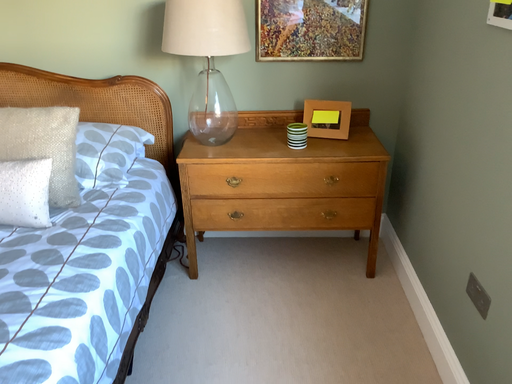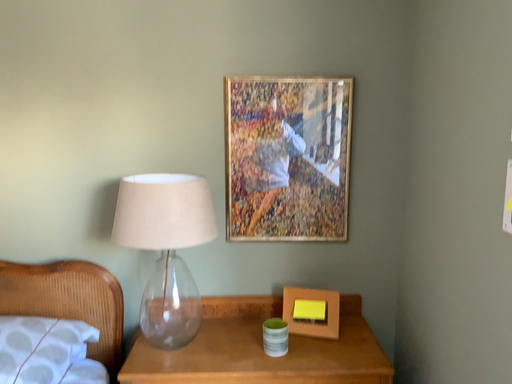
Question: Which way did the camera rotate in the video?

Choices:
 (A) rotated downward
 (B) rotated upward

Answer: (B)